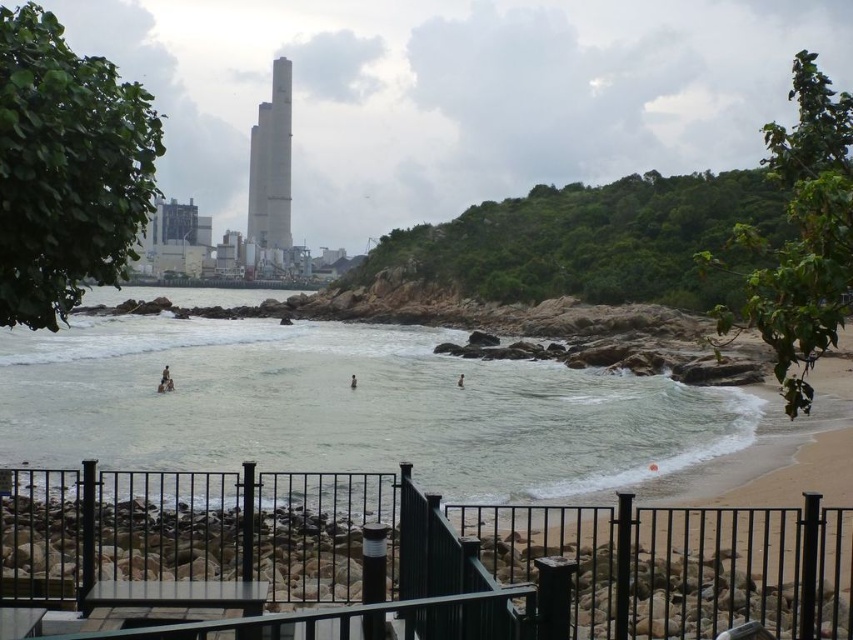
Is point (161, 346) less distant than point (352, 380)?

No.

Does clear water at beach right have a larger size compared to brown skin at center?

Indeed, clear water at beach right has a larger size compared to brown skin at center.

Where is `clear water at beach right`? The width and height of the screenshot is (853, 640). clear water at beach right is located at coordinates (351, 406).

Between skinny person at center and brown skin at water center, which one appears on the left side from the viewer's perspective?

skinny person at center is more to the left.

Does skinny person at center have a lesser height compared to brown skin at water center?

No, skinny person at center is not shorter than brown skin at water center.

Who is more distant from viewer, (161, 392) or (462, 385)?

Positioned behind is point (462, 385).

Image resolution: width=853 pixels, height=640 pixels. Find the location of `skinny person at center`. skinny person at center is located at coordinates (165, 380).

Is point (352, 378) positioned behind point (457, 380)?

No, it is in front of (457, 380).

Does brown skin at center have a lesser height compared to brown skin at water center?

Indeed, brown skin at center has a lesser height compared to brown skin at water center.

Find the location of a particular element. brown skin at center is located at coordinates (352, 381).